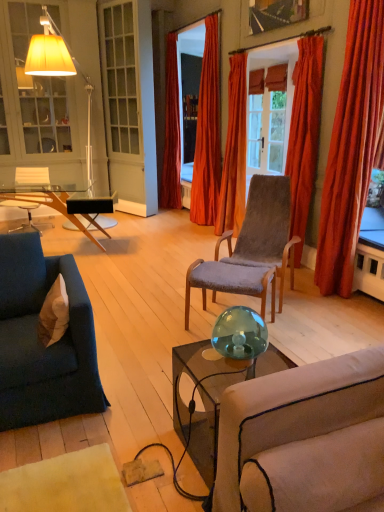
Question: Considering the relative sizes of velvet blue couch at left and wooden picture frame at upper center in the image provided, is velvet blue couch at left wider than wooden picture frame at upper center?

Choices:
 (A) yes
 (B) no

Answer: (A)

Question: Does velvet blue couch at left have a greater height compared to wooden picture frame at upper center?

Choices:
 (A) yes
 (B) no

Answer: (A)

Question: Is velvet blue couch at left not inside wooden picture frame at upper center?

Choices:
 (A) yes
 (B) no

Answer: (A)

Question: Is velvet blue couch at left in front of wooden picture frame at upper center?

Choices:
 (A) yes
 (B) no

Answer: (A)

Question: Considering the relative sizes of velvet blue couch at left and wooden picture frame at upper center in the image provided, is velvet blue couch at left shorter than wooden picture frame at upper center?

Choices:
 (A) yes
 (B) no

Answer: (B)

Question: Can you confirm if velvet blue couch at left is smaller than wooden picture frame at upper center?

Choices:
 (A) yes
 (B) no

Answer: (B)

Question: Is there a large distance between velvet grey chair at center, which is the first chair in front-to-back order, and teal glass sphere at center?

Choices:
 (A) yes
 (B) no

Answer: (A)

Question: From a real-world perspective, does velvet grey chair at center, marked as the first chair in a right-to-left arrangement, sit lower than teal glass sphere at center?

Choices:
 (A) yes
 (B) no

Answer: (A)

Question: Does velvet grey chair at center, which is the first chair in front-to-back order, have a greater height compared to teal glass sphere at center?

Choices:
 (A) yes
 (B) no

Answer: (A)

Question: Can you confirm if velvet grey chair at center, acting as the second chair starting from the back, is wider than teal glass sphere at center?

Choices:
 (A) yes
 (B) no

Answer: (A)

Question: Could teal glass sphere at center be considered to be inside velvet grey chair at center, which is the first chair in front-to-back order?

Choices:
 (A) no
 (B) yes

Answer: (A)

Question: Is velvet grey chair at center, which is the first chair in front-to-back order, to the left of teal glass sphere at center from the viewer's perspective?

Choices:
 (A) no
 (B) yes

Answer: (A)

Question: From a real-world perspective, is velvet orange curtain at upper right, which is counted as the fourth curtain, starting from the left, on white fabric pillow at lower left?

Choices:
 (A) yes
 (B) no

Answer: (A)